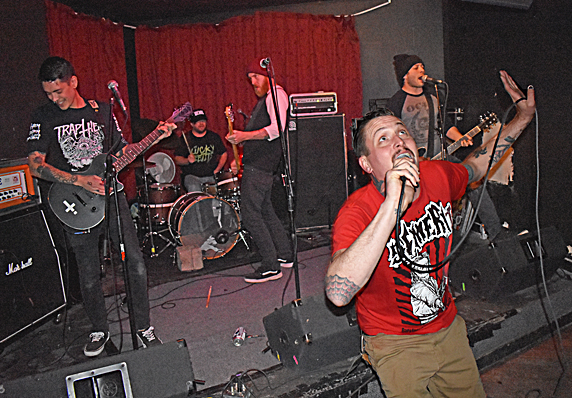
Find the location of a particular element. The image size is (572, 398). red curtain is located at coordinates (185, 63).